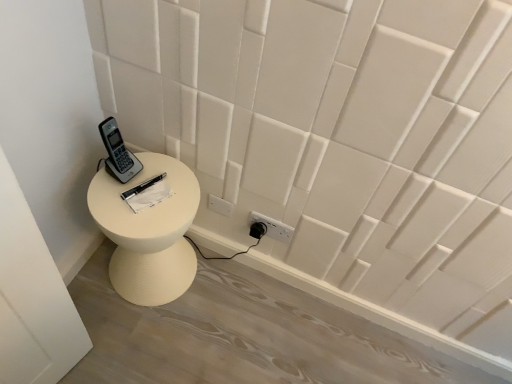
Where is `blank space situated above white matte side table at lower left (from a real-world perspective)`? blank space situated above white matte side table at lower left (from a real-world perspective) is located at coordinates (139, 190).